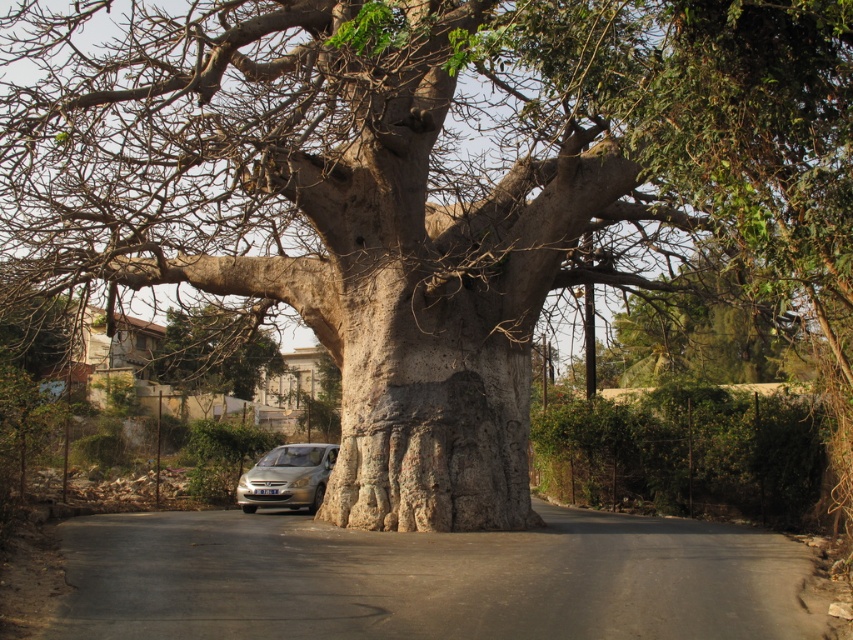
Between green leafy tree at center and silver metallic car at center, which one appears on the left side from the viewer's perspective?

Positioned to the left is green leafy tree at center.

Image resolution: width=853 pixels, height=640 pixels. What do you see at coordinates (218, 349) in the screenshot?
I see `green leafy tree at center` at bounding box center [218, 349].

Does point (234, 385) come in front of point (326, 465)?

No.

I want to click on green leafy tree at center, so click(x=218, y=349).